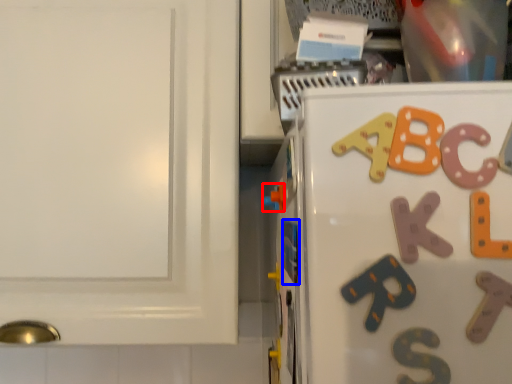
Question: Among these objects, which one is farthest to the camera, toy (highlighted by a red box) or magnet (highlighted by a blue box)?

Choices:
 (A) toy
 (B) magnet

Answer: (A)